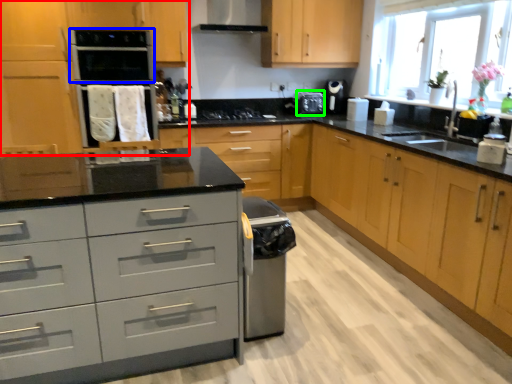
Question: Based on their relative distances, which object is farther from cabinetry (highlighted by a red box)? Choose from oven (highlighted by a blue box) and appliance (highlighted by a green box).

Choices:
 (A) oven
 (B) appliance

Answer: (B)